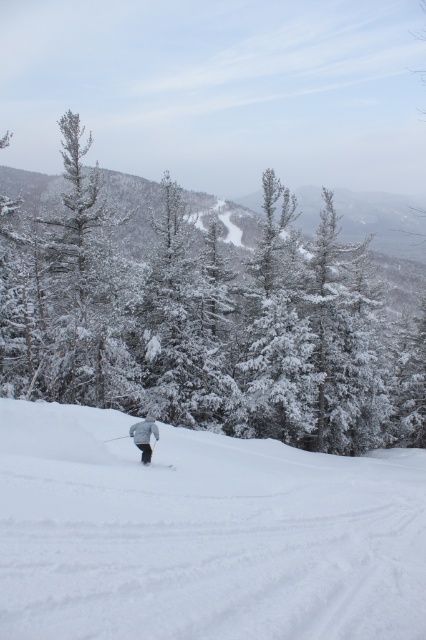
You are a skier navigating a snowy slope and see two points marked on your map. The first point is at coordinate point (132,269) and the second point is at coordinate point (141,458). If you are currently at the second point, which direction should you move to reach the first point?

Since point (132,269) is behind point (141,458), you should move in the direction away from your current position to reach the first point.